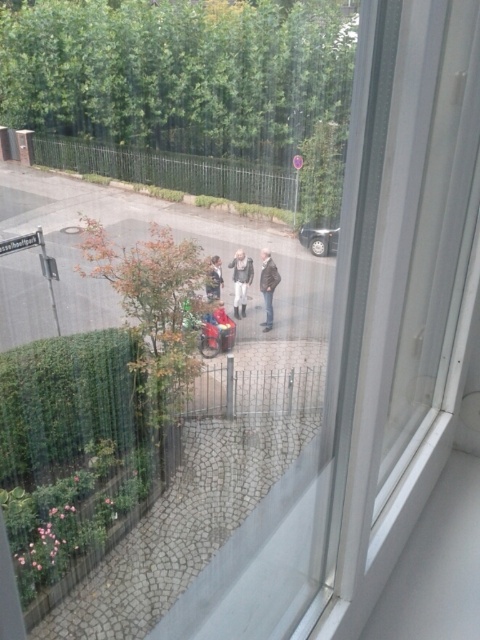
Is point (304, 228) in front of point (266, 260)?

No, (304, 228) is behind (266, 260).

Is silver metallic car at center to the left of dark gray jacket at center from the viewer's perspective?

No, silver metallic car at center is not to the left of dark gray jacket at center.

Where is `silver metallic car at center`? This screenshot has width=480, height=640. silver metallic car at center is located at coordinates 320,236.

Find the location of a particular element. The image size is (480, 640). silver metallic car at center is located at coordinates (320, 236).

Is silver metallic car at center shorter than light gray fabric jacket at center?

Correct, silver metallic car at center is not as tall as light gray fabric jacket at center.

From the picture: Between silver metallic car at center and light gray fabric jacket at center, which one is positioned lower?

light gray fabric jacket at center is lower down.

Who is more distant from viewer, (314, 237) or (240, 257)?

Point (314, 237)

Image resolution: width=480 pixels, height=640 pixels. What are the coordinates of `silver metallic car at center` in the screenshot? It's located at (320, 236).

Where is `shiny red motorcycle at center`? shiny red motorcycle at center is located at coordinates (212, 330).

Which is in front, point (203, 333) or point (250, 266)?

Point (203, 333) is in front.

Between point (215, 328) and point (235, 266), which one is positioned behind?

The point (235, 266) is more distant.

The height and width of the screenshot is (640, 480). Find the location of `shiny red motorcycle at center`. shiny red motorcycle at center is located at coordinates (212, 330).